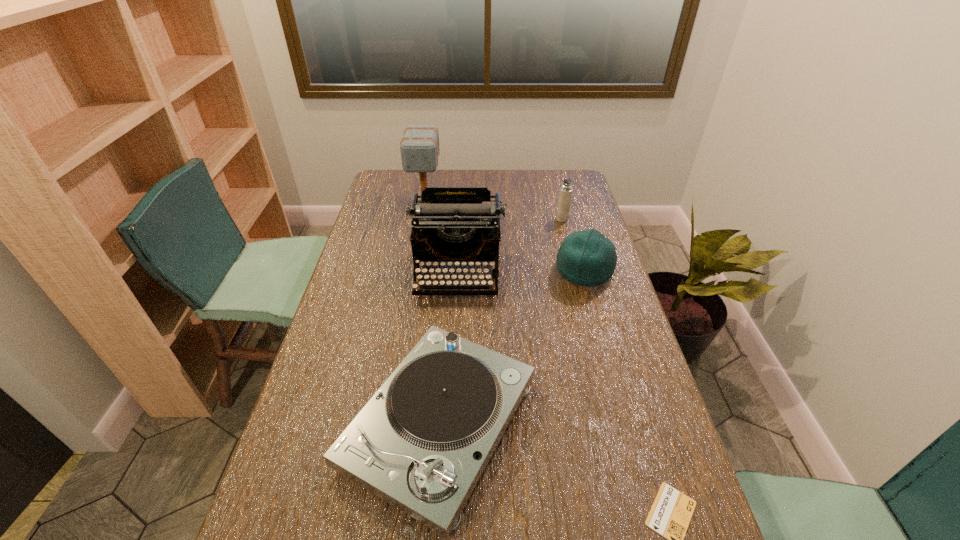
The width and height of the screenshot is (960, 540). I want to click on the fifth closest object to the shortest object, so click(419, 147).

Image resolution: width=960 pixels, height=540 pixels. I want to click on free region that satisfies the following two spatial constraints: 1. on the front side of the thermos bottle; 2. on the right side of the beanie, so click(575, 270).

Identify the location of vacant space that satisfies the following two spatial constraints: 1. on the striking surface of the mallet; 2. on the right side of the beanie. This screenshot has height=540, width=960. (413, 270).